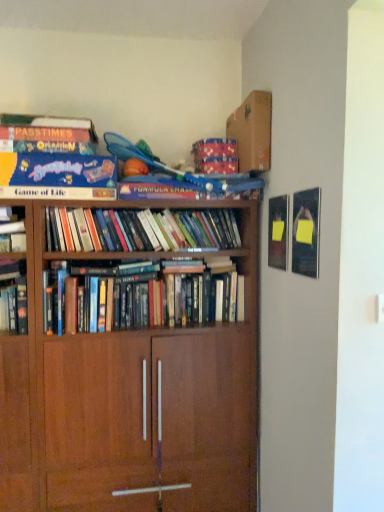
Question: Is point (117, 444) closer or farther from the camera than point (147, 266)?

Choices:
 (A) closer
 (B) farther

Answer: (A)

Question: From a real-world perspective, relative to hardcover books at center, placed as the 1th book when sorted from bottom to top, is brown wood bookcase at center vertically above or below?

Choices:
 (A) above
 (B) below

Answer: (B)

Question: Which object is the closest to the hardcover books at center, placed as the 2th book when sorted from top to bottom?

Choices:
 (A) blue cardboard game of life at upper left, arranged as the third book when ordered from the bottom
 (B) brown wood bookcase at center
 (C) cardboard at upper center
 (D) hardcover books at center, the 3th book in the top-to-bottom sequence

Answer: (D)

Question: Which of these objects is positioned farthest from the cardboard at upper center?

Choices:
 (A) hardcover books at center, the 3th book in the top-to-bottom sequence
 (B) blue cardboard game of life at upper left, placed as the first book when sorted from top to bottom
 (C) hardcover books at center, acting as the 2th book starting from the bottom
 (D) brown wood bookcase at center

Answer: (D)